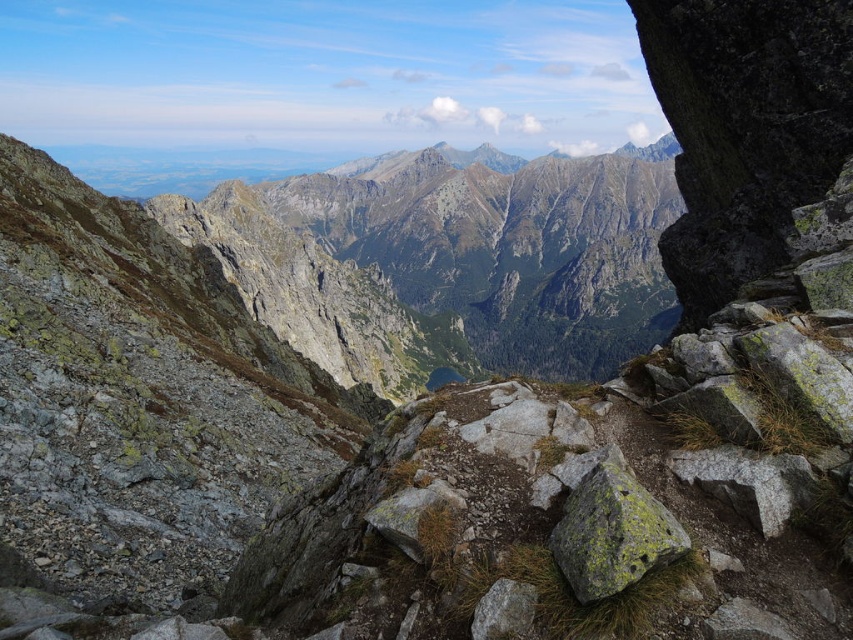
You are a hiker planning to navigate the rugged terrain in the foreground of the mountain view. You notice two points marked on your map at coordinates point (624, 572) and point (511, 589). Which point is more accessible for setting up a temporary camp due to its proximity to your current position?

Point (624, 572) is closer to the viewer than point (511, 589), so it would be more accessible for setting up a temporary camp as it is nearer to your current position.